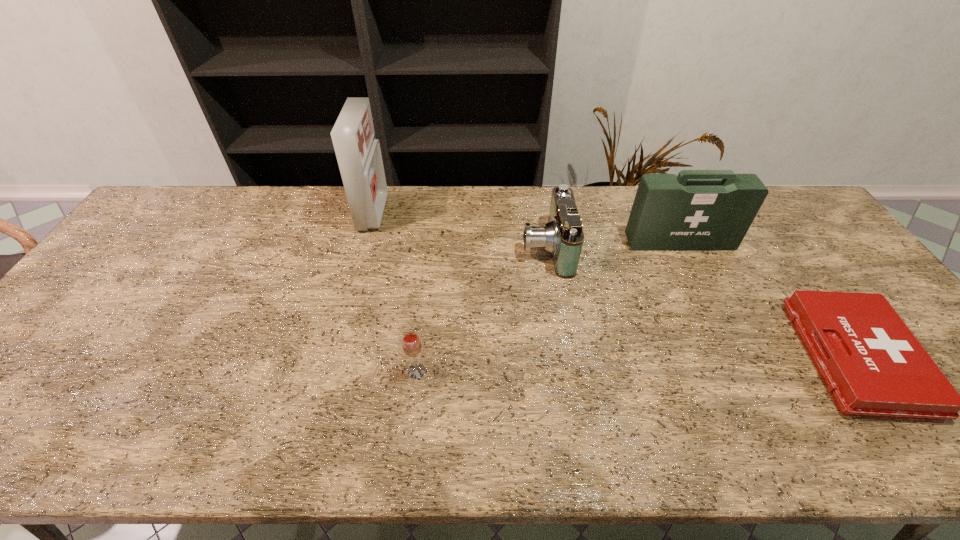
This screenshot has height=540, width=960. I want to click on unoccupied area between the second tallest first-aid kit and the second object from left to right, so click(x=548, y=307).

Identify which object is the second closest to the wineglass. Please provide its 2D coordinates. Your answer should be formatted as a tuple, i.e. [(x, y)], where the tuple contains the x and y coordinates of a point satisfying the conditions above.

[(358, 152)]

The width and height of the screenshot is (960, 540). Find the location of `object that is the fourth closest to the wineglass`. object that is the fourth closest to the wineglass is located at coordinates (871, 363).

Image resolution: width=960 pixels, height=540 pixels. What are the coordinates of `the first-aid kit that is the nearest to the farthest first-aid kit` in the screenshot? It's located at (699, 210).

Image resolution: width=960 pixels, height=540 pixels. Find the location of `the first-aid kit identified as the second closest to the second farthest first-aid kit`. the first-aid kit identified as the second closest to the second farthest first-aid kit is located at coordinates (358, 152).

Identify the location of vacant space that satisfies the following two spatial constraints: 1. on the front-facing side of the second farthest first-aid kit; 2. on the front-facing side of the third object from left to right. The width and height of the screenshot is (960, 540). (682, 248).